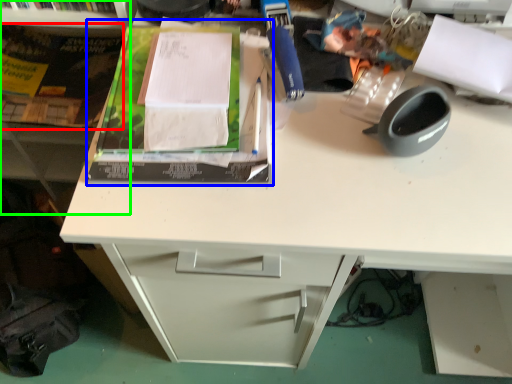
Question: Which object is the closest to the paperback book (highlighted by a red box)? Choose among these: paperback book (highlighted by a blue box) or bookshelf (highlighted by a green box).

Choices:
 (A) paperback book
 (B) bookshelf

Answer: (B)